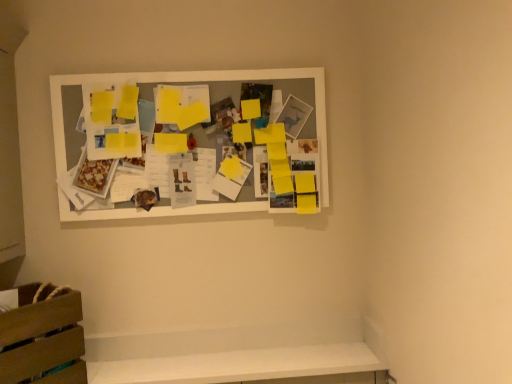
Where is `vacant area on top of white matte picture frame at upper center (from a real-world perspective)`? The width and height of the screenshot is (512, 384). vacant area on top of white matte picture frame at upper center (from a real-world perspective) is located at coordinates (182, 69).